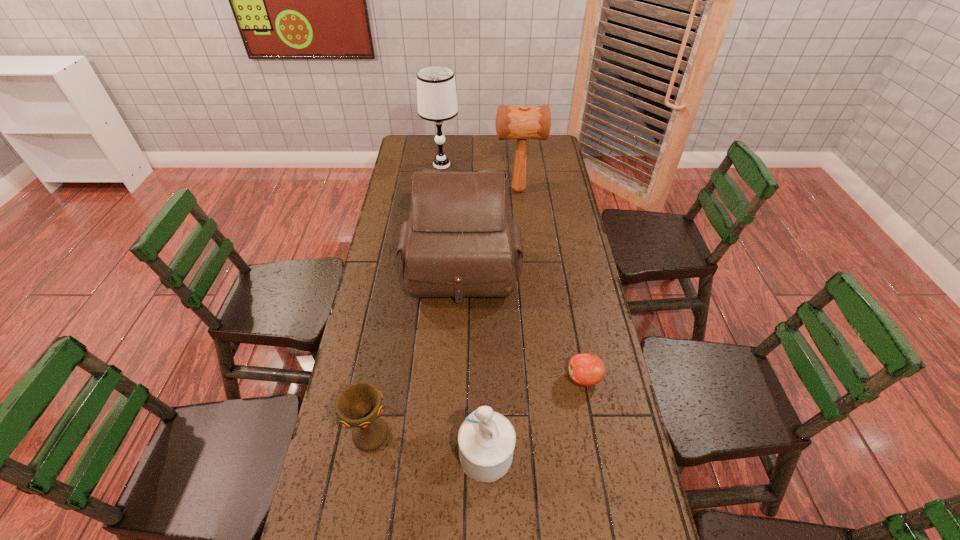
Where is `free space that satisfies the following two spatial constraints: 1. on the strike surface of the shortest object; 2. on the right side of the mallet`? The height and width of the screenshot is (540, 960). free space that satisfies the following two spatial constraints: 1. on the strike surface of the shortest object; 2. on the right side of the mallet is located at coordinates (538, 379).